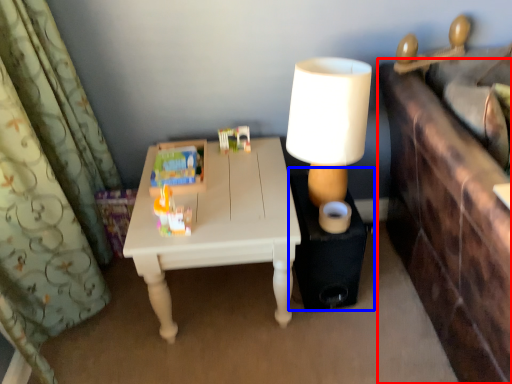
Question: Which point is closer to the camera, vanity (highlighted by a red box) or side table (highlighted by a blue box)?

Choices:
 (A) vanity
 (B) side table

Answer: (A)